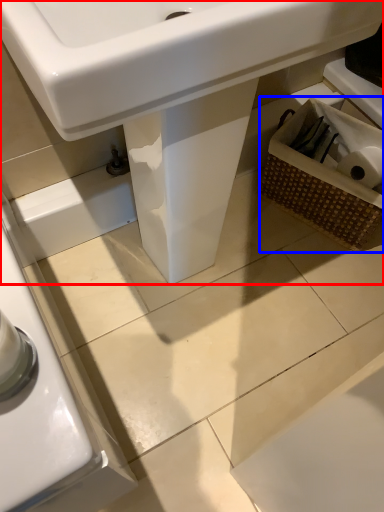
Question: Among these objects, which one is farthest to the camera, sink (highlighted by a red box) or basket (highlighted by a blue box)?

Choices:
 (A) sink
 (B) basket

Answer: (B)